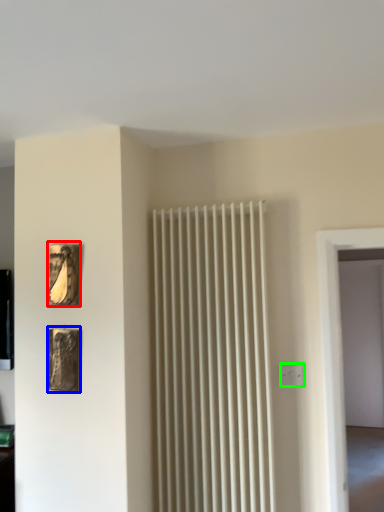
Question: Based on their relative distances, which object is nearer to picture frame (highlighted by a red box)? Choose from picture frame (highlighted by a blue box) and electric outlet (highlighted by a green box).

Choices:
 (A) picture frame
 (B) electric outlet

Answer: (A)